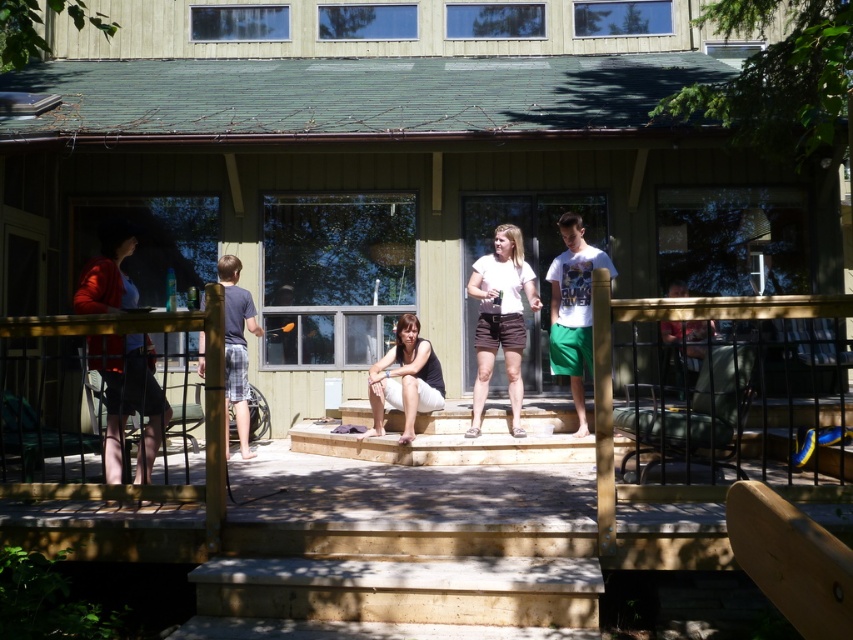
Based on the coordinates provided, which object is located at point (x=573, y=308)?

The white cotton t shirt at center is located at point (x=573, y=308).